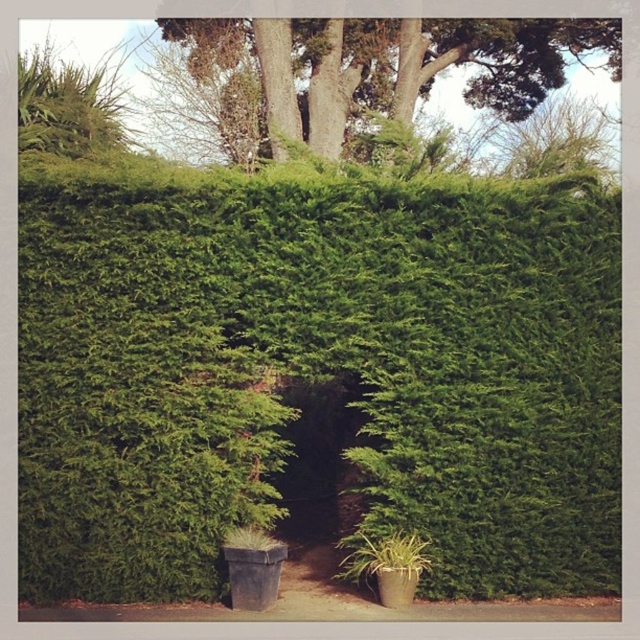
From the picture: You are a landscape architect designing a garden. You have a 20 feet long decorative fence that you want to place between the green leafy hedge at center and the green leafy tree at upper center. Can the fence fit between them without overlapping either the hedge or the tree?

The distance between the green leafy hedge at center and the green leafy tree at upper center is 22.05 feet. Since the fence is only 20 feet long, it can fit between them without overlapping either the hedge or the tree.

You are standing on the pathway in front of the green leafy hedge at center and the green leafy tree at upper center. Which object is closer to you?

The green leafy hedge at center is closer to you because it is positioned under the green leafy tree at upper center, indicating it is in front of the tree.